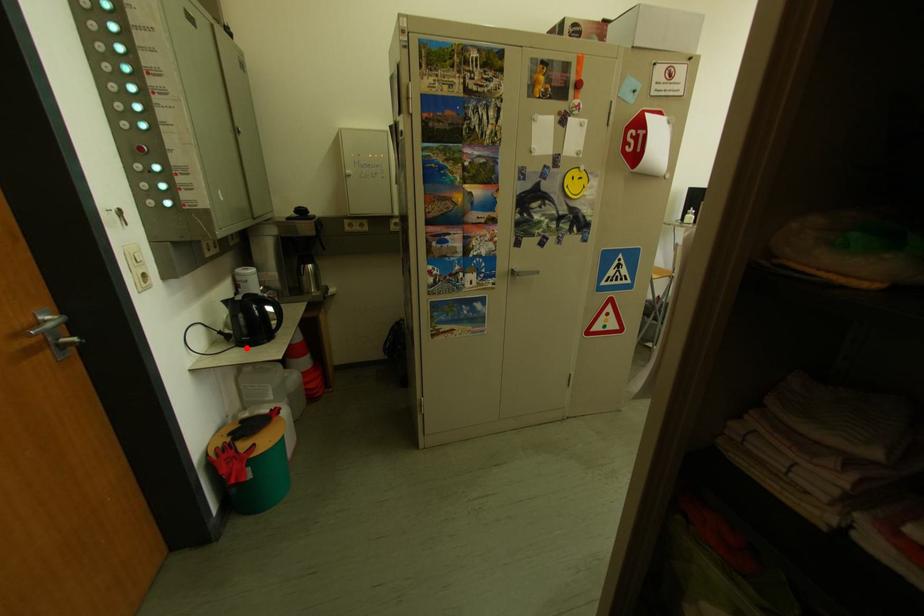
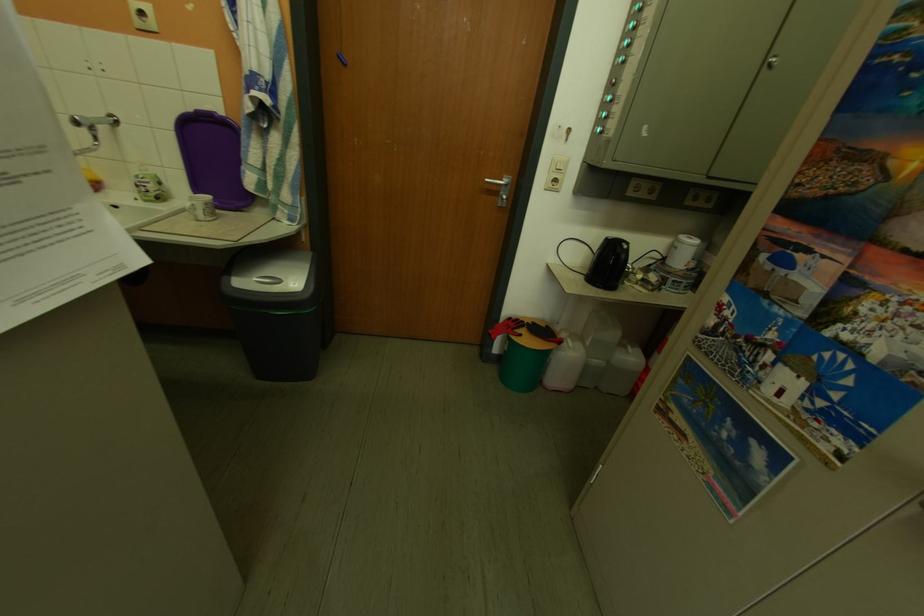
Where in the second image is the point corresponding to the highlighted location from the first image?

(599, 277)